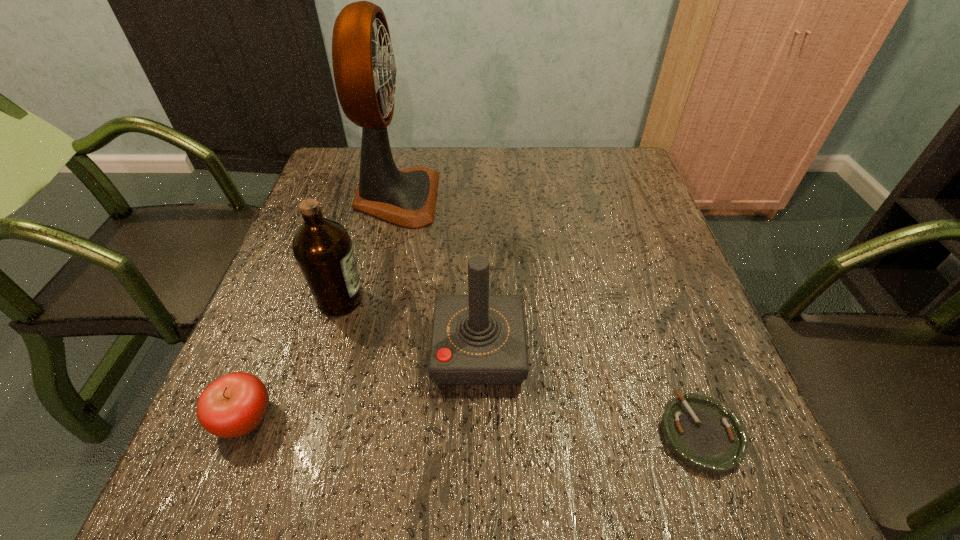
I want to click on vacant region that satisfies the following two spatial constraints: 1. on the rectangular base of the joystick; 2. on the back side of the rightmost object, so click(479, 433).

Find the location of a particular element. The height and width of the screenshot is (540, 960). free space in the image that satisfies the following two spatial constraints: 1. on the rectangular base of the ashtray; 2. on the left side of the joystick is located at coordinates (479, 433).